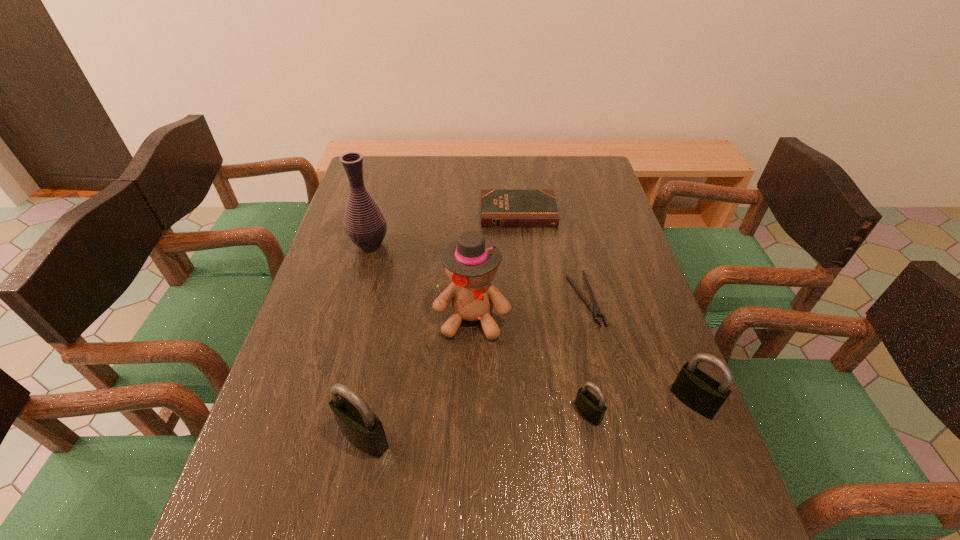
Identify which object is the sixth nearest to the leftmost padlock. Please provide its 2D coordinates. Your answer should be formatted as a tuple, i.e. [(x, y)], where the tuple contains the x and y coordinates of a point satisfying the conditions above.

[(499, 208)]

Identify which object is the closest to the leftmost padlock. Please provide its 2D coordinates. Your answer should be formatted as a tuple, i.e. [(x, y)], where the tuple contains the x and y coordinates of a point satisfying the conditions above.

[(471, 264)]

Where is `the third closest padlock to the shortest object`? The height and width of the screenshot is (540, 960). the third closest padlock to the shortest object is located at coordinates (360, 426).

At what (x,y) coordinates should I click in order to perform the action: click on padlock that is the second closest to the sixth shortest object. Please return your answer as a coordinate pair (x, y). Looking at the image, I should click on (360, 426).

Where is `vacant area that satisfies the following two spatial constraints: 1. on the front side of the sixth nearest object; 2. on the right side of the leftmost padlock`? This screenshot has height=540, width=960. vacant area that satisfies the following two spatial constraints: 1. on the front side of the sixth nearest object; 2. on the right side of the leftmost padlock is located at coordinates (317, 438).

Identify the location of free space that satisfies the following two spatial constraints: 1. on the front-facing side of the sixth shortest object; 2. on the right side of the fourth tallest object. (470, 401).